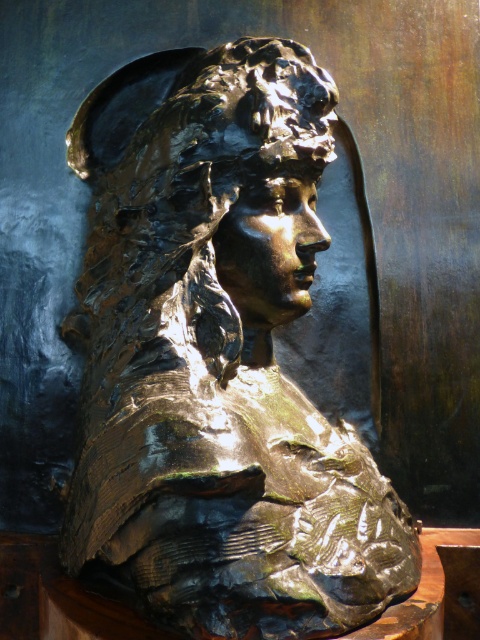
Can you confirm if bronze bust at center is smaller than bronze sculpture at center?

Actually, bronze bust at center might be larger than bronze sculpture at center.

Which is behind, point (245, 426) or point (186, 339)?

Point (186, 339)

This screenshot has height=640, width=480. Find the location of `bronze bust at center`. bronze bust at center is located at coordinates (223, 371).